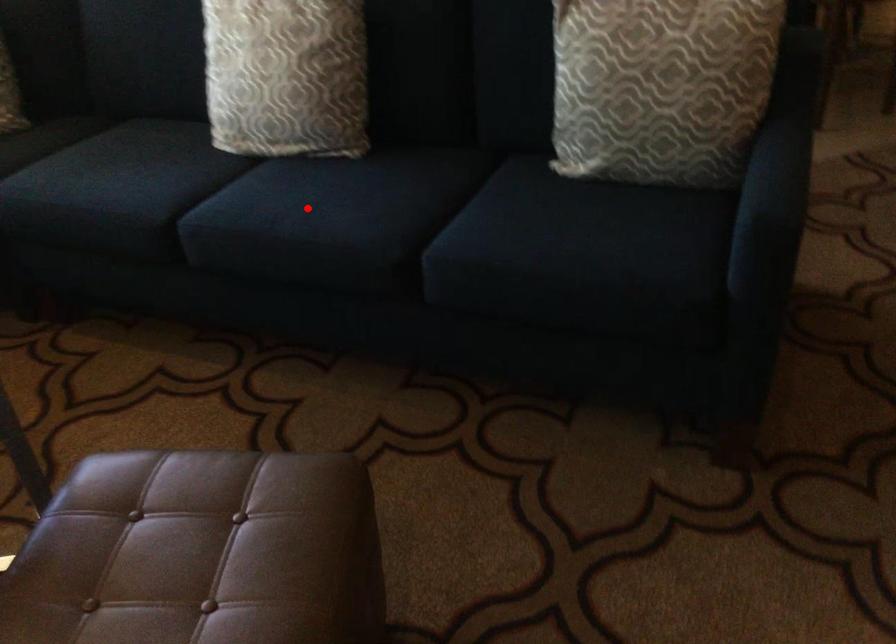
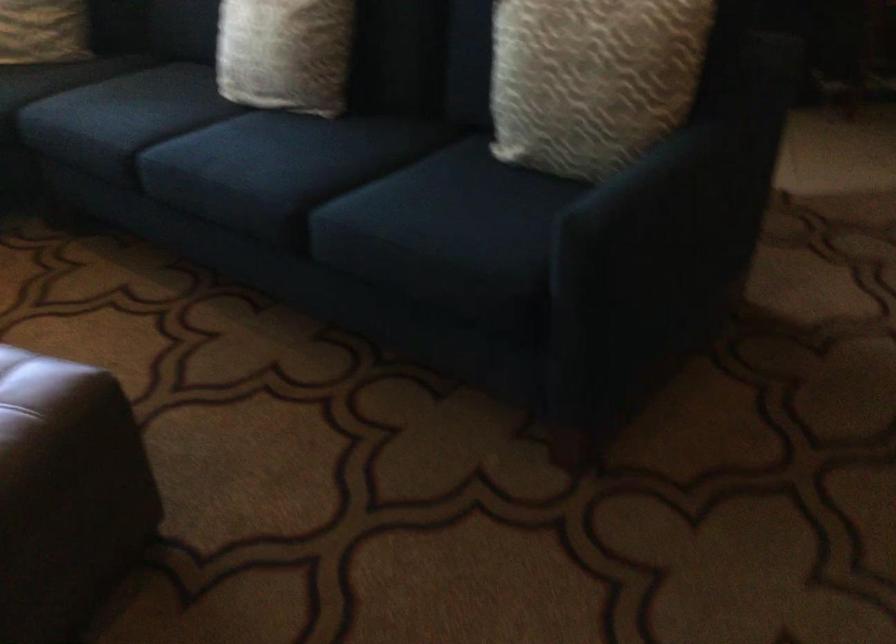
In the second image, find the point that corresponds to the highlighted location in the first image.

(245, 154)